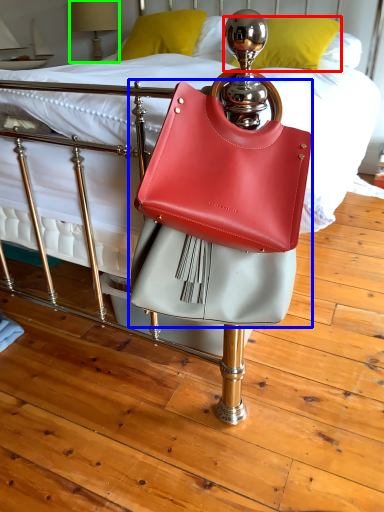
Question: Which object is positioned farthest from pillow (highlighted by a red box)? Select from handbag (highlighted by a blue box) and table lamp (highlighted by a green box).

Choices:
 (A) handbag
 (B) table lamp

Answer: (A)